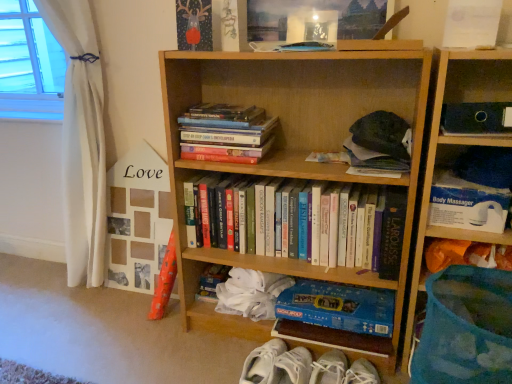
Question: Is hardcover books at upper left, the 3th book from the bottom, completely or partially inside white fabric sneakers at lower center?

Choices:
 (A) yes
 (B) no

Answer: (B)

Question: Is white fabric sneakers at lower center behind hardcover books at upper left, which is counted as the second book, starting from the top?

Choices:
 (A) no
 (B) yes

Answer: (A)

Question: Does white fabric sneakers at lower center have a greater width compared to hardcover books at upper left, which is counted as the second book, starting from the top?

Choices:
 (A) yes
 (B) no

Answer: (A)

Question: Is white fabric sneakers at lower center placed right next to hardcover books at upper left, which is counted as the second book, starting from the top?

Choices:
 (A) no
 (B) yes

Answer: (A)

Question: Is white fabric sneakers at lower center at the right side of hardcover books at upper left, which is counted as the second book, starting from the top?

Choices:
 (A) yes
 (B) no

Answer: (A)

Question: Considering their positions, is hardcover book at upper center, which appears as the fourth book when ordered from the bottom, located in front of or behind white fabric curtain at left?

Choices:
 (A) behind
 (B) front

Answer: (B)

Question: Based on their sizes in the image, would you say hardcover book at upper center, which appears as the first book when viewed from the top, is bigger or smaller than white fabric curtain at left?

Choices:
 (A) small
 (B) big

Answer: (A)

Question: From a real-world perspective, relative to white fabric curtain at left, is hardcover book at upper center, which appears as the first book when viewed from the top, vertically above or below?

Choices:
 (A) below
 (B) above

Answer: (B)

Question: Does point (308, 44) appear closer or farther from the camera than point (98, 79)?

Choices:
 (A) farther
 (B) closer

Answer: (B)

Question: Looking at the image, does blue cardboard monopoly game at lower center, which is counted as the 1th book, starting from the bottom, seem bigger or smaller compared to hardcover book at upper center, which appears as the fourth book when ordered from the bottom?

Choices:
 (A) small
 (B) big

Answer: (B)

Question: Does point (369, 317) appear closer or farther from the camera than point (311, 44)?

Choices:
 (A) farther
 (B) closer

Answer: (A)

Question: From a real-world perspective, is blue cardboard monopoly game at lower center, the fourth book when ordered from top to bottom, physically located above or below hardcover book at upper center, which appears as the fourth book when ordered from the bottom?

Choices:
 (A) above
 (B) below

Answer: (B)

Question: Relative to hardcover book at upper center, which appears as the fourth book when ordered from the bottom, is blue cardboard monopoly game at lower center, which is counted as the 1th book, starting from the bottom, in front or behind?

Choices:
 (A) front
 (B) behind

Answer: (B)

Question: From a real-world perspective, is hardcover book at upper center, which appears as the fourth book when ordered from the bottom, above or below hardcover books at upper left, which is counted as the second book, starting from the top?

Choices:
 (A) above
 (B) below

Answer: (A)

Question: In the image, is hardcover book at upper center, which appears as the fourth book when ordered from the bottom, on the left side or the right side of hardcover books at upper left, the 3th book from the bottom?

Choices:
 (A) left
 (B) right

Answer: (B)